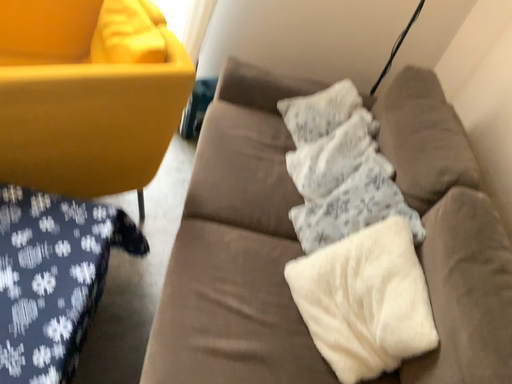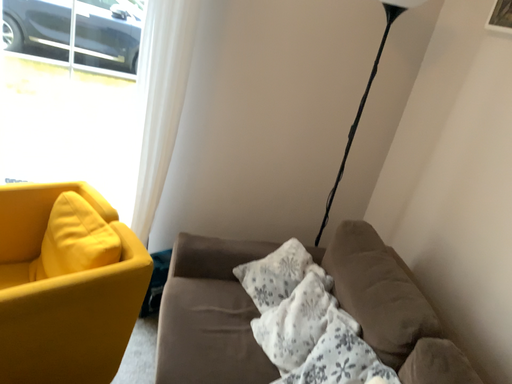
Question: Which way did the camera rotate in the video?

Choices:
 (A) rotated downward
 (B) rotated upward

Answer: (B)